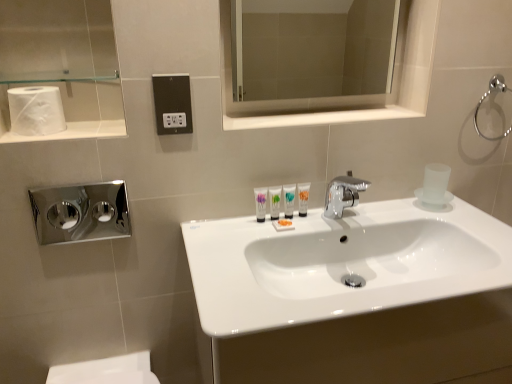
I want to click on vacant position to the left of polished chrome faucet at center, so click(x=290, y=225).